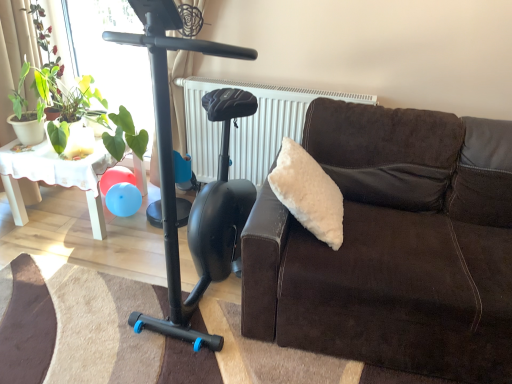
Question: Is green leafy plant at left, the 1th plant positioned from the right, aimed at white lace table at left?

Choices:
 (A) yes
 (B) no

Answer: (B)

Question: Does green leafy plant at left, the 2th plant positioned from the left, have a lesser height compared to white lace table at left?

Choices:
 (A) yes
 (B) no

Answer: (B)

Question: Considering the relative sizes of green leafy plant at left, the 2th plant positioned from the left, and white lace table at left in the image provided, is green leafy plant at left, the 2th plant positioned from the left, wider than white lace table at left?

Choices:
 (A) no
 (B) yes

Answer: (A)

Question: Is green leafy plant at left, the 2th plant positioned from the left, located outside white lace table at left?

Choices:
 (A) no
 (B) yes

Answer: (B)

Question: Is white lace table at left a part of green leafy plant at left, the 2th plant positioned from the left?

Choices:
 (A) no
 (B) yes

Answer: (A)

Question: Is green leafy plant at left, the 2th plant positioned from the left, positioned far away from white lace table at left?

Choices:
 (A) no
 (B) yes

Answer: (A)

Question: Is brown suede couch at right in front of white textured radiator at upper center?

Choices:
 (A) no
 (B) yes

Answer: (B)

Question: From a real-world perspective, is brown suede couch at right positioned under white textured radiator at upper center based on gravity?

Choices:
 (A) yes
 (B) no

Answer: (A)

Question: From a real-world perspective, is brown suede couch at right on top of white textured radiator at upper center?

Choices:
 (A) yes
 (B) no

Answer: (B)

Question: Can you confirm if brown suede couch at right is shorter than white textured radiator at upper center?

Choices:
 (A) yes
 (B) no

Answer: (B)

Question: From the image's perspective, is brown suede couch at right located beneath white textured radiator at upper center?

Choices:
 (A) no
 (B) yes

Answer: (B)

Question: Is brown suede couch at right positioned far away from white textured radiator at upper center?

Choices:
 (A) yes
 (B) no

Answer: (B)

Question: From the image's perspective, is green leafy plant at upper left, the second plant positioned from the right, below white textured radiator at upper center?

Choices:
 (A) yes
 (B) no

Answer: (B)